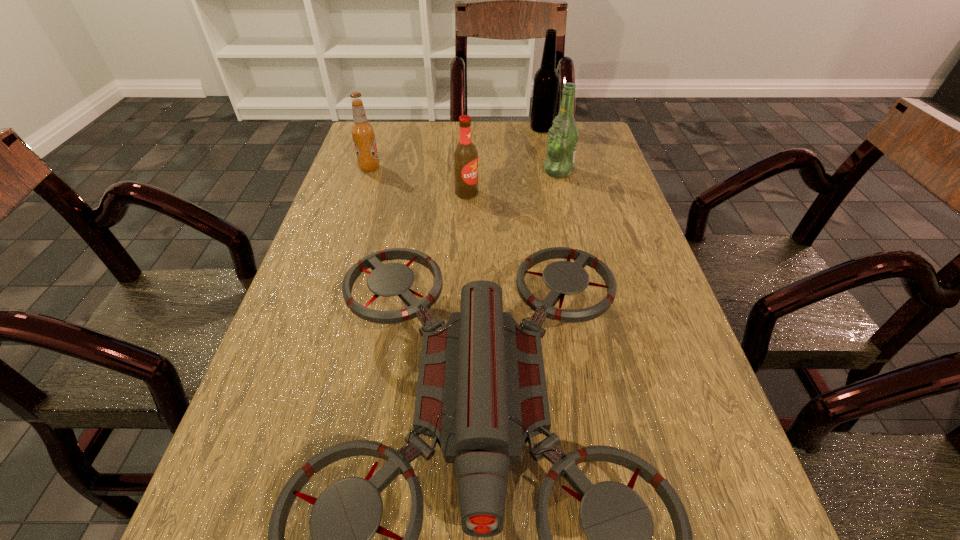
The height and width of the screenshot is (540, 960). Identify the location of beer bottle that is the second closest one to the second beer bottle from left to right. click(x=362, y=132).

The width and height of the screenshot is (960, 540). I want to click on beer bottle object that ranks as the third closest to the farthest beer bottle, so click(362, 132).

Image resolution: width=960 pixels, height=540 pixels. I want to click on free space that satisfies the following two spatial constraints: 1. on the front label of the third beer bottle from right to left; 2. on the left side of the leftmost object, so click(361, 193).